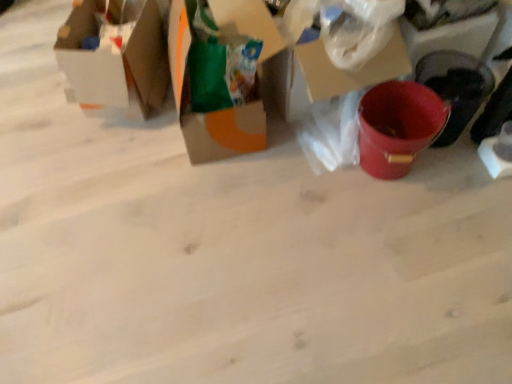
The image size is (512, 384). I want to click on free spot in front of cardboard box at center, the 2th box viewed from the left, so click(218, 190).